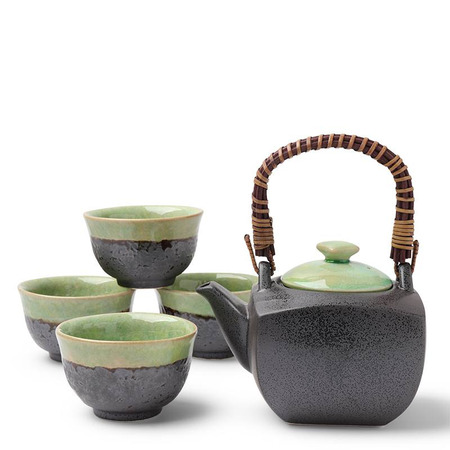
Where is `dark grey/black botton layer of cup`? The height and width of the screenshot is (450, 450). dark grey/black botton layer of cup is located at coordinates (207, 343), (127, 384), (48, 331), (143, 269).